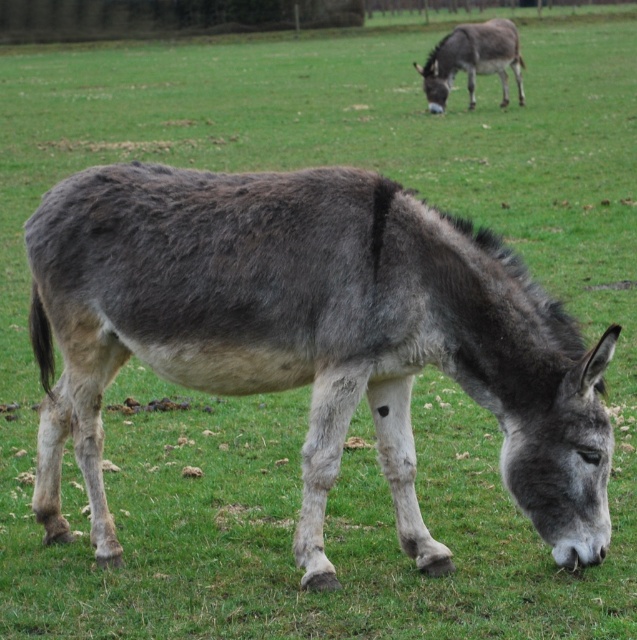
Question: Which object is farther from the camera taking this photo?

Choices:
 (A) gray fuzzy donkey at center
 (B) gray matte mule at upper right

Answer: (B)

Question: Is gray fuzzy donkey at center to the right of gray matte mule at upper right from the viewer's perspective?

Choices:
 (A) yes
 (B) no

Answer: (B)

Question: From the image, what is the correct spatial relationship of gray fuzzy donkey at center in relation to gray matte mule at upper right?

Choices:
 (A) left
 (B) right

Answer: (A)

Question: Among these points, which one is farthest from the camera?

Choices:
 (A) (x=483, y=60)
 (B) (x=115, y=291)

Answer: (A)

Question: Is the position of gray fuzzy donkey at center more distant than that of gray matte mule at upper right?

Choices:
 (A) no
 (B) yes

Answer: (A)